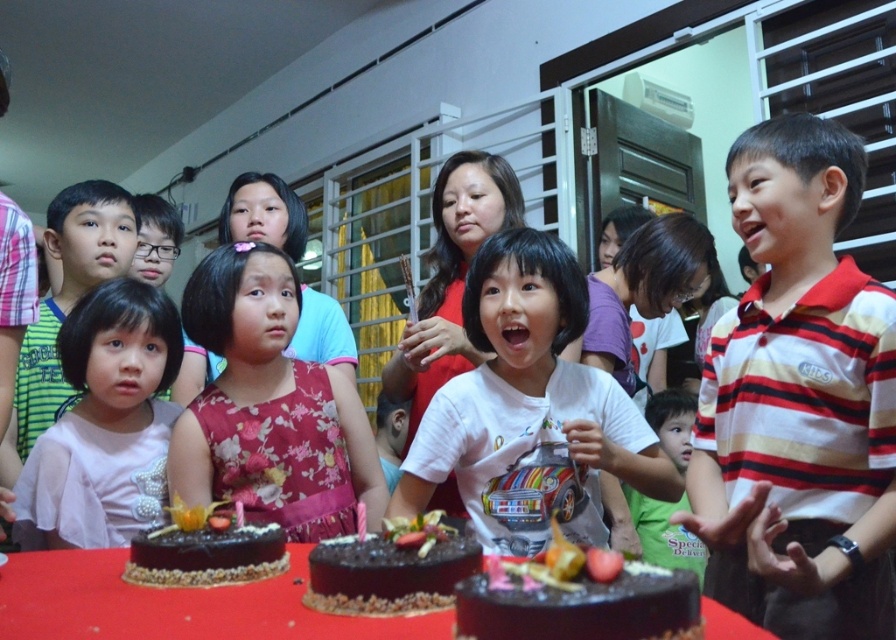
You are a photographer at the birthday party and need to capture a photo of both the pink fabric shirt at left and the chocolate frosted cake at lower left. Which object should you focus on first if you want to ensure both are in the frame without moving the camera?

The pink fabric shirt at left is bigger than the chocolate frosted cake at lower left, so you should focus on the pink fabric shirt at left first to ensure both fit in the frame.

In the birthday celebration scene, there are two children near the table with three chocolate cakes. One child is wearing a white graphic tshirt in the foreground, and the other is wearing a striped cotton shirt at right. If you were standing at the point marked by coordinates (798,401), which child would you be facing?

The point marked by coordinates (798,401) corresponds to the location of the striped cotton shirt at right. Therefore, if you were standing there, you would be facing the striped cotton shirt at right.